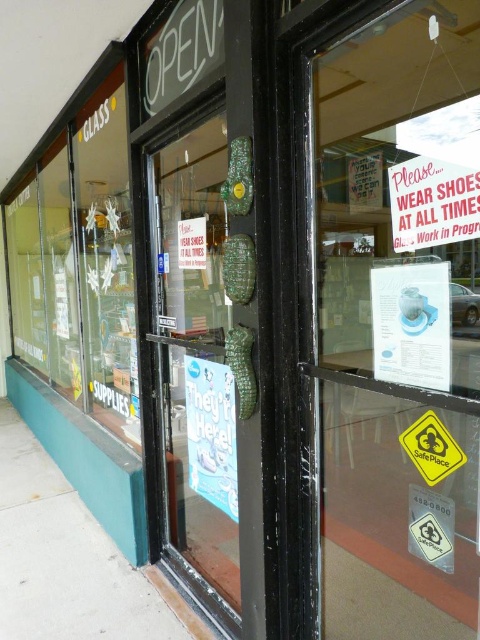
Is green textured doorknob at center below white paper sign at upper right?

Indeed, green textured doorknob at center is positioned under white paper sign at upper right.

Can you confirm if green textured doorknob at center is positioned above white paper sign at upper right?

No.

Is point (227, 442) closer to camera compared to point (441, 241)?

That is False.

The height and width of the screenshot is (640, 480). What are the coordinates of `green textured doorknob at center` in the screenshot? It's located at (208, 368).

In the scene shown: Is transparent glass door at center wider than green textured doorknob at center?

Incorrect, transparent glass door at center's width does not surpass green textured doorknob at center's.

Does transparent glass door at center appear over green textured doorknob at center?

Yes.

Where is `transparent glass door at center`? Image resolution: width=480 pixels, height=640 pixels. transparent glass door at center is located at coordinates (399, 323).

Does transparent glass door at center have a lesser height compared to white paper sign at upper right?

No.

Which is in front, point (427, 474) or point (411, 186)?

Point (411, 186) is more forward.

At what (x,y) coordinates should I click in order to perform the action: click on transparent glass door at center. Please return your answer as a coordinate pair (x, y). This screenshot has width=480, height=640. Looking at the image, I should click on (399, 323).